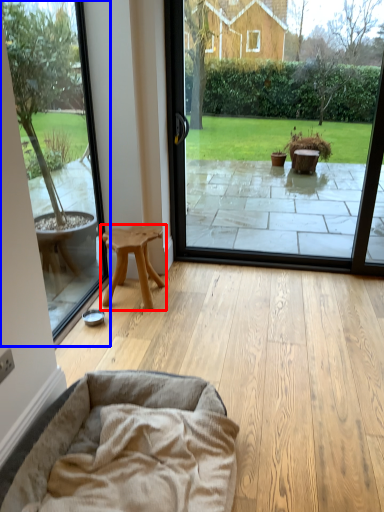
Question: Which point is further to the camera, stool (highlighted by a red box) or window screen (highlighted by a blue box)?

Choices:
 (A) stool
 (B) window screen

Answer: (A)